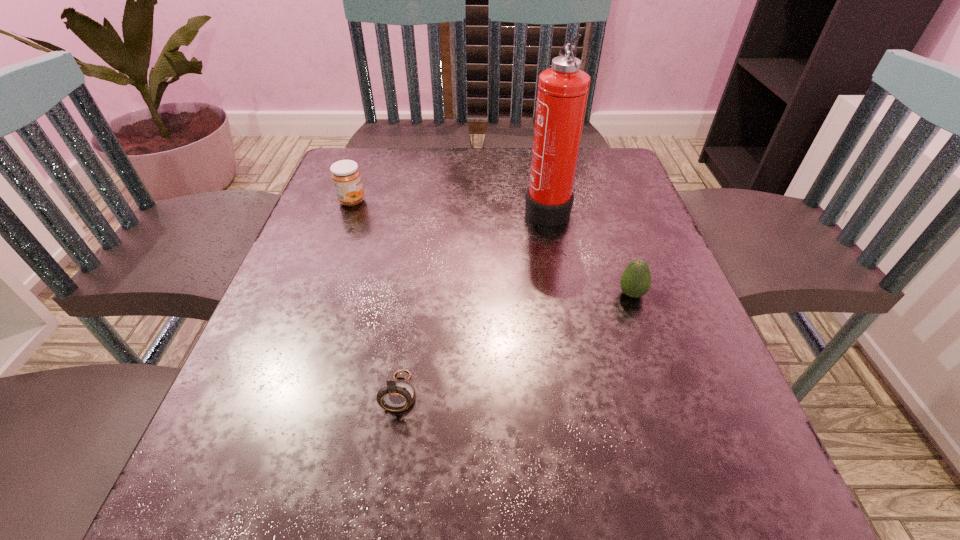
Find the location of a particular element. the third object from left to right is located at coordinates (563, 89).

Locate an element on the screen. This screenshot has height=540, width=960. fire extinguisher is located at coordinates (563, 89).

Locate an element on the screen. the leftmost object is located at coordinates (346, 177).

Locate an element on the screen. the rightmost object is located at coordinates (635, 282).

The image size is (960, 540). Identify the location of the second nearest object. (635, 282).

Identify the location of the second object from left to right. The width and height of the screenshot is (960, 540). (398, 395).

Where is `the nearest object`? Image resolution: width=960 pixels, height=540 pixels. the nearest object is located at coordinates pyautogui.click(x=398, y=395).

The height and width of the screenshot is (540, 960). I want to click on free region located on the front-facing side of the fire extinguisher, so click(x=421, y=207).

Identify the location of free space located 0.080m on the front-facing side of the fire extinguisher. (490, 207).

Locate an element on the screen. vacant space located 0.240m on the front-facing side of the fire extinguisher is located at coordinates (421, 207).